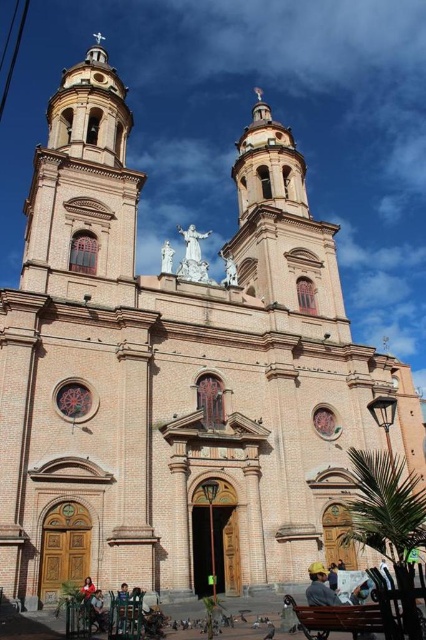
Can you confirm if brown wooden bench at lower center is shorter than white marble statue at center?

Yes.

Is point (311, 634) behind point (204, 234)?

No.

Is point (342, 611) less distant than point (190, 252)?

Yes, point (342, 611) is closer to viewer.

You are a GUI agent. You are given a task and a screenshot of the screen. Output one action in this format:
    pyautogui.click(x=<x>, y=<y>)
    Task: Click on the brown wooden bench at lower center
    The image size is (426, 640).
    Given the screenshot: What is the action you would take?
    pyautogui.click(x=342, y=620)

Is white marble statue at center closer to camera compared to reddish-brown leather jacket at lower center?

No, white marble statue at center is further to the viewer.

What do you see at coordinates (192, 243) in the screenshot? Image resolution: width=426 pixels, height=640 pixels. I see `white marble statue at center` at bounding box center [192, 243].

Identify the location of white marble statue at center. (192, 243).

Between point (305, 625) and point (89, 586), which one is positioned in front?

Point (305, 625)

Is brown wooden bench at lower center taller than reddish-brown leather jacket at lower center?

Indeed, brown wooden bench at lower center has a greater height compared to reddish-brown leather jacket at lower center.

Which is in front, point (299, 605) or point (86, 579)?

Point (86, 579)

Locate an element on the screen. brown wooden bench at lower center is located at coordinates (342, 620).